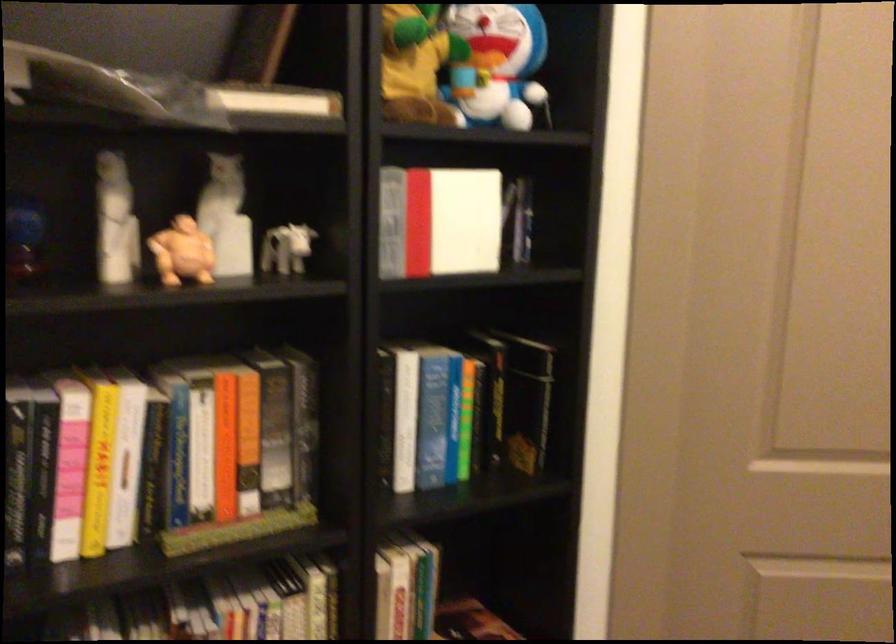
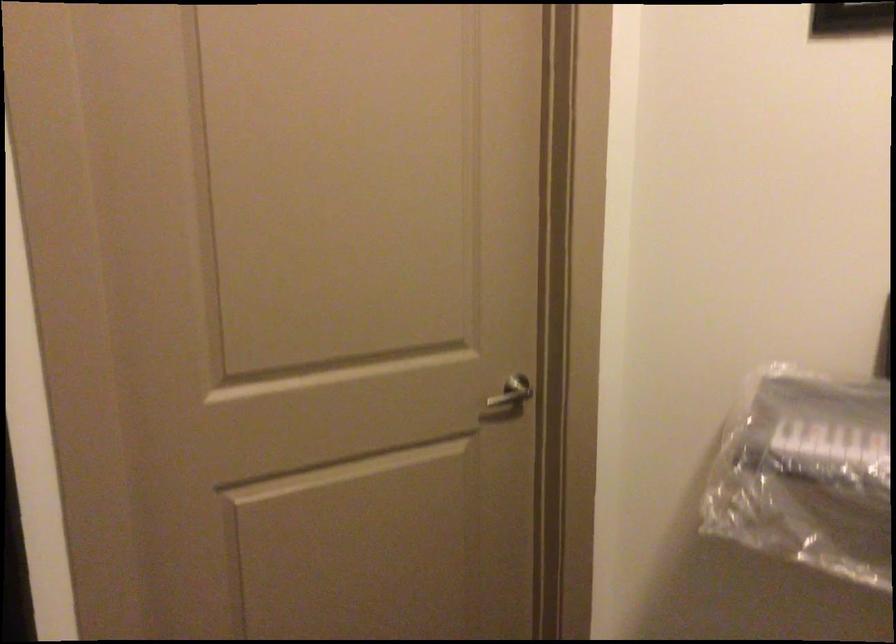
Question: The camera is either moving clockwise (left) or counter-clockwise (right) around the object. The first image is from the beginning of the video and the second image is from the end. Is the camera moving left or right when shooting the video?

Choices:
 (A) Left
 (B) Right

Answer: (A)